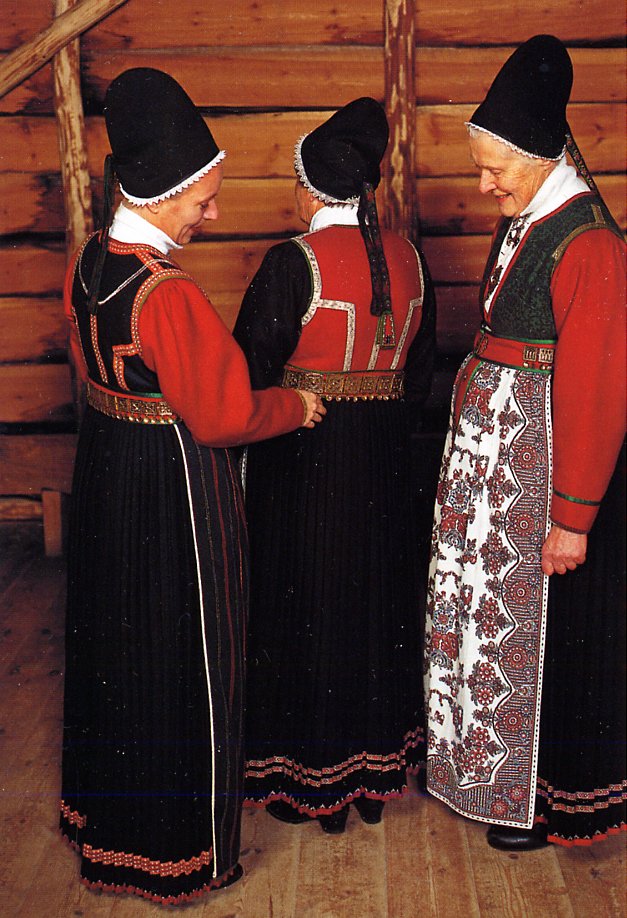
Identify the location of wooden floor. The image size is (627, 918). (399, 897).